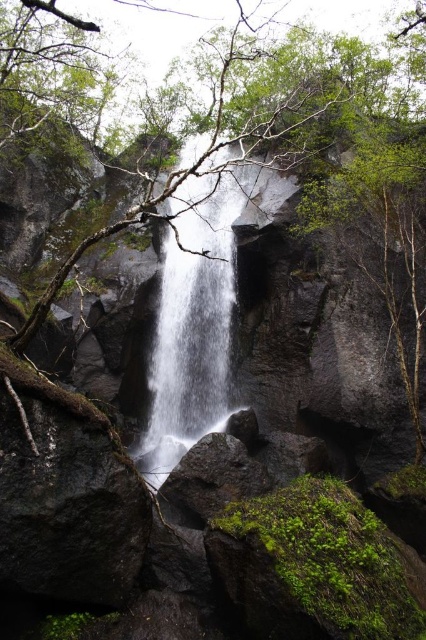
How much distance is there between smooth bark tree at center and dark gray rock at center?

smooth bark tree at center is 7.81 meters away from dark gray rock at center.

Can you confirm if smooth bark tree at center is positioned above dark gray rock at center?

Yes.

Between point (196, 196) and point (106, 529), which one is positioned in front?

Point (106, 529) is more forward.

Identify the location of smooth bark tree at center. (296, 157).

Can you confirm if dark gray rock at center is positioned above white textured waterfall at center?

No.

Does dark gray rock at center have a lesser height compared to white textured waterfall at center?

Yes, dark gray rock at center is shorter than white textured waterfall at center.

Locate an element on the screen. This screenshot has width=426, height=640. dark gray rock at center is located at coordinates (68, 508).

Who is shorter, smooth bark tree at center or white textured waterfall at center?

white textured waterfall at center is shorter.

Does smooth bark tree at center have a greater height compared to white textured waterfall at center?

Indeed, smooth bark tree at center has a greater height compared to white textured waterfall at center.

Locate an element on the screen. smooth bark tree at center is located at coordinates (296, 157).